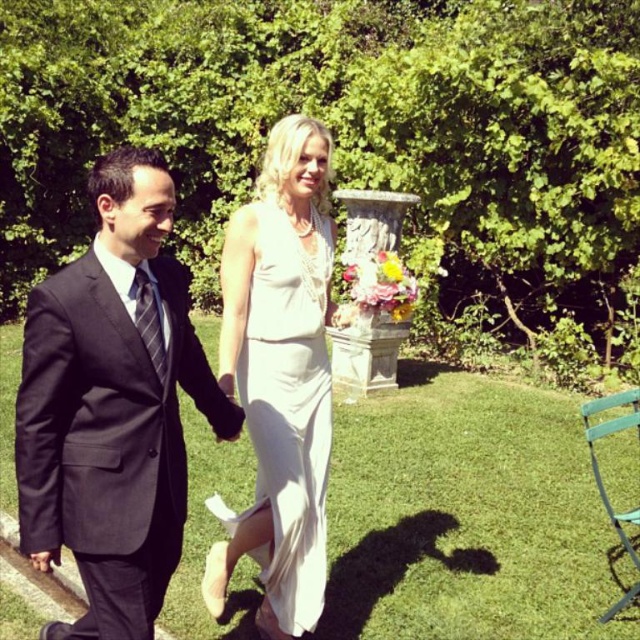
Question: Is green grass at center wider than white satin dress at center?

Choices:
 (A) yes
 (B) no

Answer: (A)

Question: Considering the relative positions of black suit at left and white satin dress at center in the image provided, where is black suit at left located with respect to white satin dress at center?

Choices:
 (A) left
 (B) right

Answer: (A)

Question: Can you confirm if green grass at center is smaller than black suit at left?

Choices:
 (A) yes
 (B) no

Answer: (A)

Question: Which of these objects is positioned farthest from the green grass at center?

Choices:
 (A) white satin dress at center
 (B) black suit at left

Answer: (B)

Question: Which point is farther from the camera taking this photo?

Choices:
 (A) (100, 416)
 (B) (472, 513)
 (C) (301, 336)

Answer: (B)

Question: Considering the real-world distances, which object is closest to the white satin dress at center?

Choices:
 (A) black suit at left
 (B) green grass at center

Answer: (A)